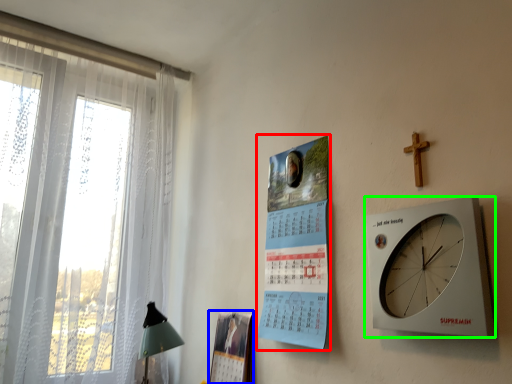
Question: Which object is the closest to the poster page (highlighted by a red box)? Choose among these: magazine (highlighted by a blue box) or wall clock (highlighted by a green box).

Choices:
 (A) magazine
 (B) wall clock

Answer: (A)